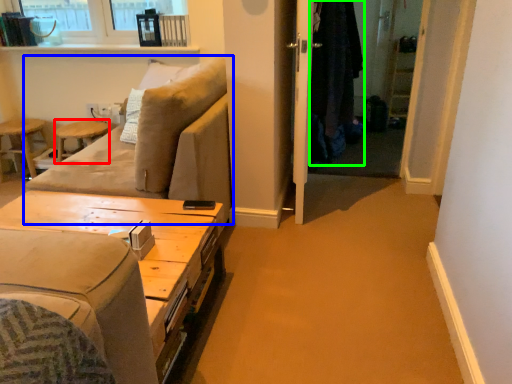
Question: Which object is positioned farthest from bar stool (highlighted by a red box)? Select from studio couch (highlighted by a blue box) and robe (highlighted by a green box).

Choices:
 (A) studio couch
 (B) robe

Answer: (B)